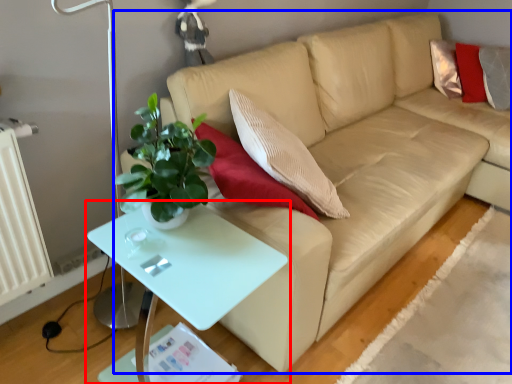
Question: Which object is further to the camera taking this photo, table (highlighted by a red box) or studio couch (highlighted by a blue box)?

Choices:
 (A) table
 (B) studio couch

Answer: (B)